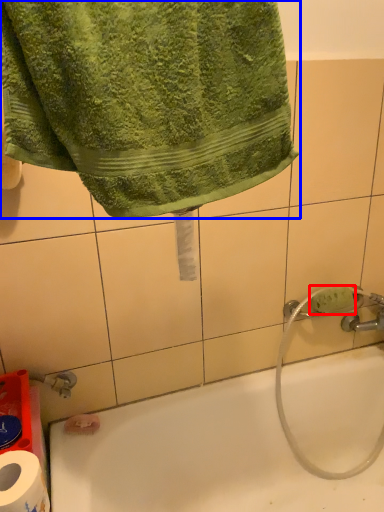
Question: Which point is closer to the camera, soap (highlighted by a red box) or towel (highlighted by a blue box)?

Choices:
 (A) soap
 (B) towel

Answer: (B)